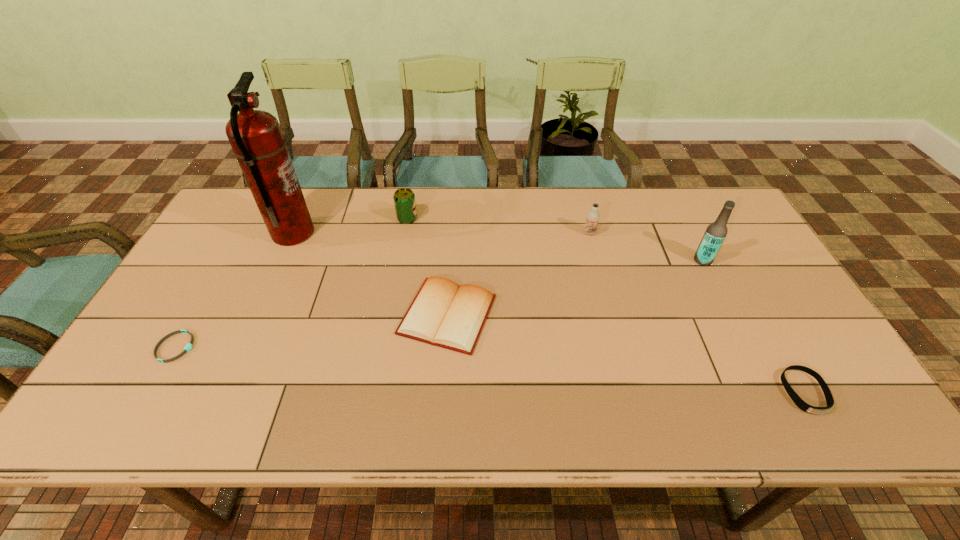
Where is `free space at the right edge of the desktop`? The height and width of the screenshot is (540, 960). free space at the right edge of the desktop is located at coordinates (729, 250).

The height and width of the screenshot is (540, 960). Identify the location of vacant space at the far left corner of the desktop. (226, 222).

What are the coordinates of `free space at the far right corner of the desktop` in the screenshot? It's located at (722, 207).

What are the coordinates of `vacant area at the near right corner` in the screenshot? It's located at (828, 431).

The width and height of the screenshot is (960, 540). I want to click on free spot between the rightmost object and the Bible, so click(626, 353).

Locate an element on the screen. The height and width of the screenshot is (540, 960). free spot between the fifth object from left to right and the beer can is located at coordinates (498, 226).

I want to click on free point between the chocolate milk and the shortest object, so click(383, 290).

Locate an element on the screen. The image size is (960, 540). vacant area that lies between the rightmost object and the beer can is located at coordinates (606, 305).

I want to click on vacant space that's between the beer can and the fifth object from left to right, so click(x=498, y=226).

You are a GUI agent. You are given a task and a screenshot of the screen. Output one action in this format:
    pyautogui.click(x=<x>, y=<y>)
    Task: Click on the vacant space in between the shorter wristband and the third object from right to left
    
    Given the screenshot: What is the action you would take?
    pyautogui.click(x=383, y=290)